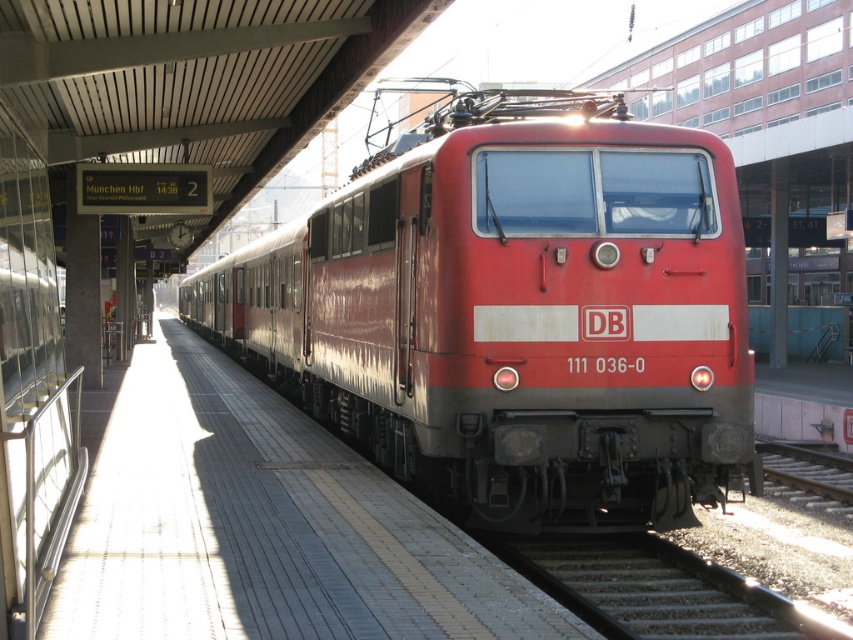
You are standing on the platform at the train station and see the point marked at coordinates (515, 310). What object is located at that point?

The point at coordinates (515, 310) marks the matte red train at center.

Where is the matte red train at center located in the image?

The matte red train at center is located at point coordinates of (515,310).